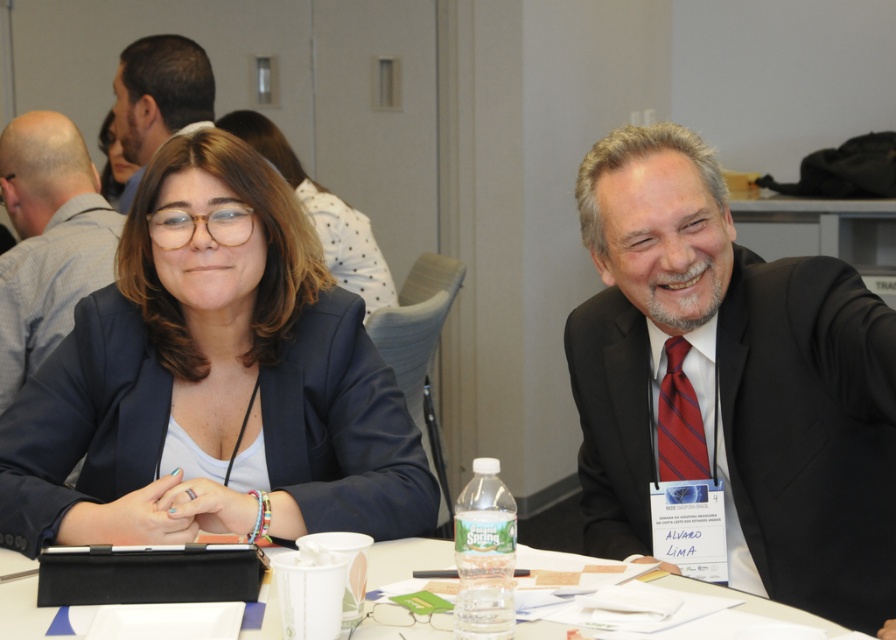
Question: Which object is closer to the camera taking this photo?

Choices:
 (A) matte black glasses at center
 (B) white paper at center
 (C) matte black hair at upper center

Answer: (B)

Question: Can you confirm if matte black blazer at center is thinner than matte black suit at center?

Choices:
 (A) yes
 (B) no

Answer: (B)

Question: Among these points, which one is farthest from the camera?

Choices:
 (A) (261, 122)
 (B) (101, 124)
 (C) (657, 432)
 (D) (823, 504)

Answer: (B)

Question: Which point is closer to the camera?

Choices:
 (A) (790, 516)
 (B) (669, 380)
 (C) (145, 212)

Answer: (A)

Question: Is white paper at center behind matte black hair at upper center?

Choices:
 (A) yes
 (B) no

Answer: (B)

Question: Is matte black suit at center in front of white paper at center?

Choices:
 (A) yes
 (B) no

Answer: (B)